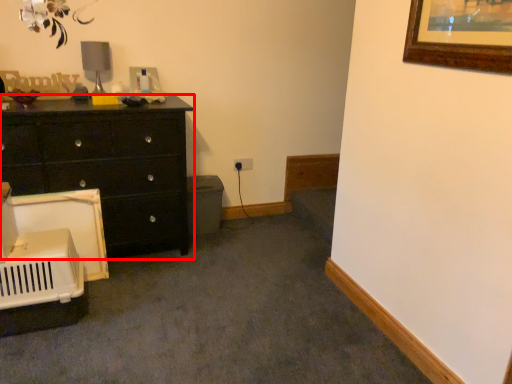
Question: Considering the relative positions of chest of drawers (annotated by the red box) and table lamp in the image provided, where is chest of drawers (annotated by the red box) located with respect to the staircase?

Choices:
 (A) right
 (B) left

Answer: (B)